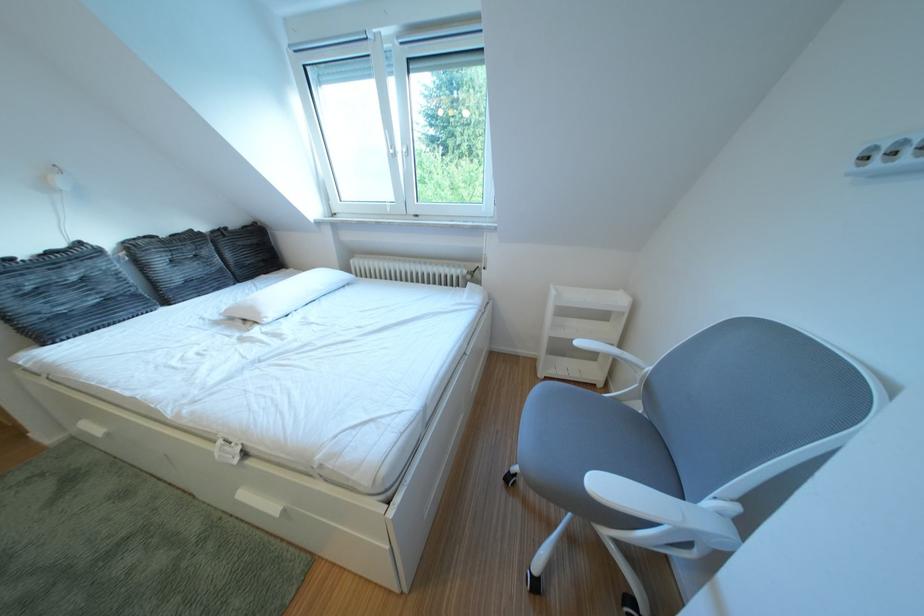
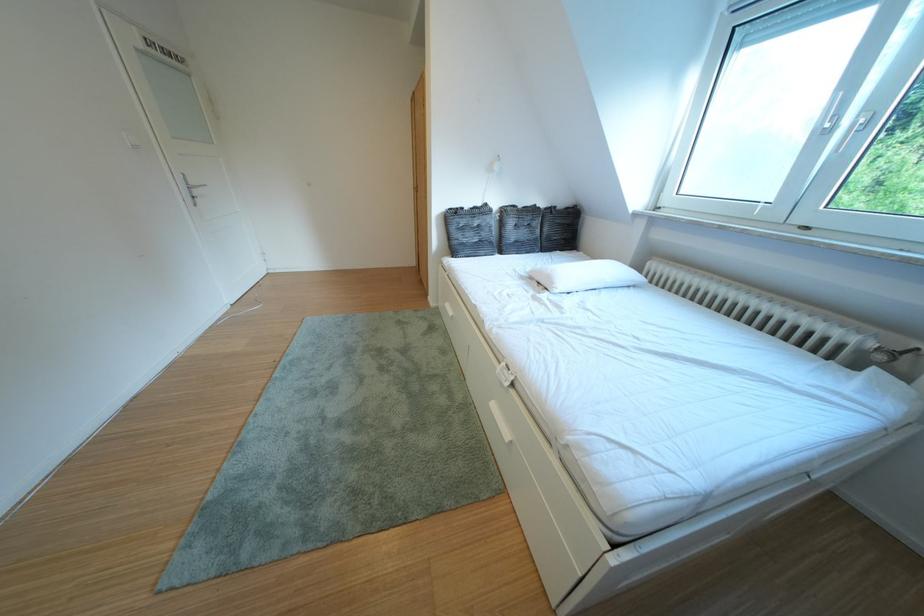
The point at (273, 318) is marked in the first image. Where is the corresponding point in the second image?

(565, 288)